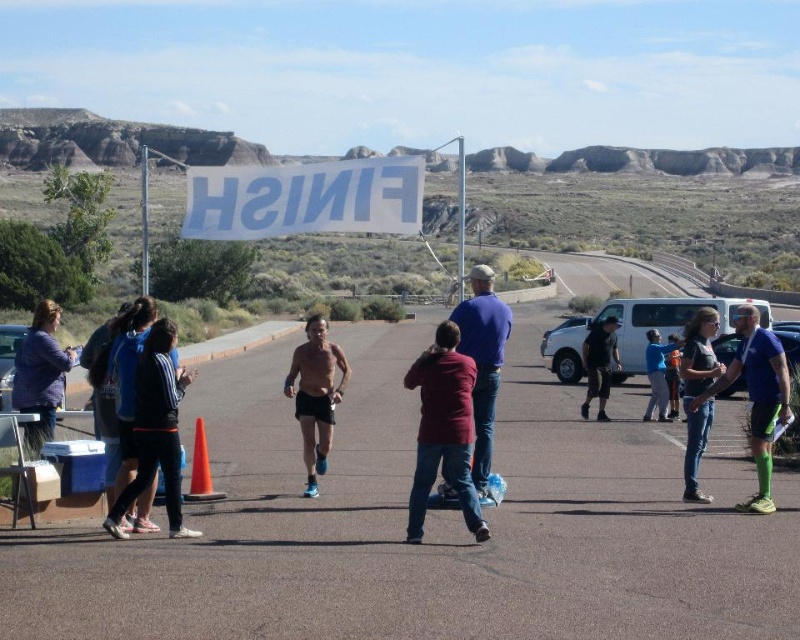
Is blue fabric shirt at center positioned at the back of matte purple jacket at left?

No, blue fabric shirt at center is in front of matte purple jacket at left.

What do you see at coordinates (758, 396) in the screenshot?
I see `blue fabric shirt at center` at bounding box center [758, 396].

What do you see at coordinates (758, 396) in the screenshot? The height and width of the screenshot is (640, 800). I see `blue fabric shirt at center` at bounding box center [758, 396].

This screenshot has height=640, width=800. Find the location of `blue fabric shirt at center`. blue fabric shirt at center is located at coordinates (758, 396).

Looking at this image, does asphalt road at center have a lesser width compared to blue fabric jacket at center?

In fact, asphalt road at center might be wider than blue fabric jacket at center.

Can you confirm if asphalt road at center is positioned above blue fabric jacket at center?

Yes, asphalt road at center is above blue fabric jacket at center.

Measure the distance between point (252, 452) and camera.

The distance of point (252, 452) from camera is 141.35 feet.

This screenshot has height=640, width=800. I want to click on asphalt road at center, so click(x=428, y=524).

Consider the image. Who is lower down, asphalt road at center or black matte jacket at center?

asphalt road at center

Can you confirm if asphalt road at center is bigger than black matte jacket at center?

Yes.

Who is more forward, (372, 536) or (592, 388)?

Point (372, 536)

Where is `asphalt road at center`? This screenshot has height=640, width=800. asphalt road at center is located at coordinates (428, 524).